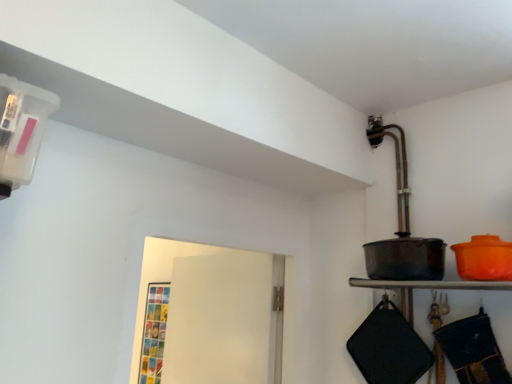
This screenshot has height=384, width=512. What do you see at coordinates (431, 284) in the screenshot?
I see `metallic black pot at right` at bounding box center [431, 284].

You are a GUI agent. You are given a task and a screenshot of the screen. Output one action in this format:
    pyautogui.click(x=<x>, y=<y>)
    Task: Click on the metallic black pot at right
    This screenshot has height=384, width=512.
    Given the screenshot: What is the action you would take?
    pyautogui.click(x=431, y=284)

In the scene shown: What is the approximate width of metallic black pot at right?

It is 9.39 inches.

At what (x,y) coordinates should I click in order to perform the action: click on metallic black pot at right. Please return your answer as a coordinate pair (x, y). This screenshot has width=512, height=384. Looking at the image, I should click on (431, 284).